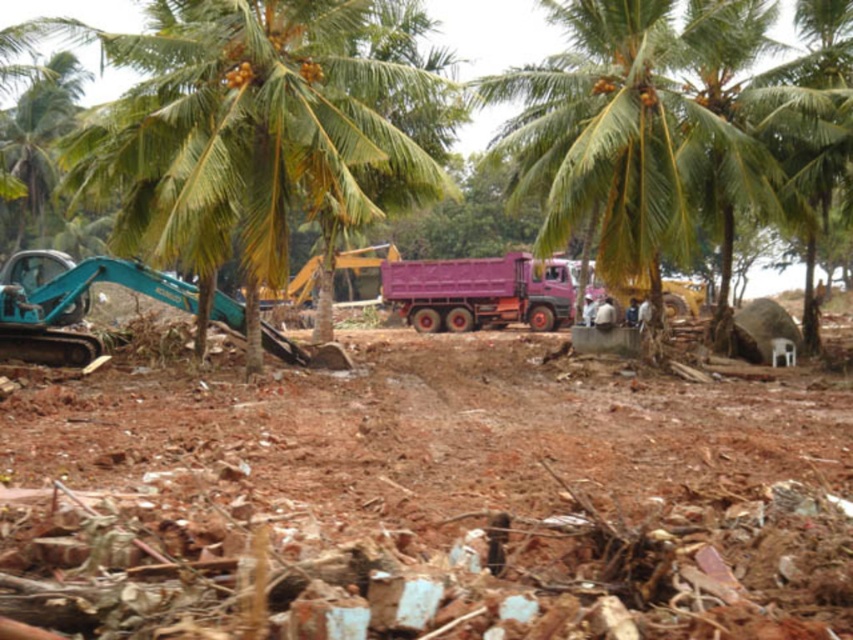
From the picture: Can you confirm if green leafy coconut tree at center is taller than teal metallic excavator at left?

Yes.

Does green leafy coconut tree at center have a smaller size compared to teal metallic excavator at left?

No.

Does point (158, 172) come in front of point (78, 316)?

Yes, it is.

Locate an element on the screen. The image size is (853, 640). green leafy coconut tree at center is located at coordinates (251, 132).

Consider the image. Is pink matte truck at center taller than teal metallic excavator at left?

Correct, pink matte truck at center is much taller as teal metallic excavator at left.

Where is `pink matte truck at center`? pink matte truck at center is located at coordinates (479, 292).

Does brown earthy dirt field at center have a lesser height compared to green leafy coconut tree at center?

Yes.

Who is higher up, brown earthy dirt field at center or green leafy coconut tree at center?

green leafy coconut tree at center is above.

Does point (804, 492) come closer to viewer compared to point (276, 342)?

Yes, it is in front of point (276, 342).

Locate an element on the screen. The image size is (853, 640). brown earthy dirt field at center is located at coordinates (434, 499).